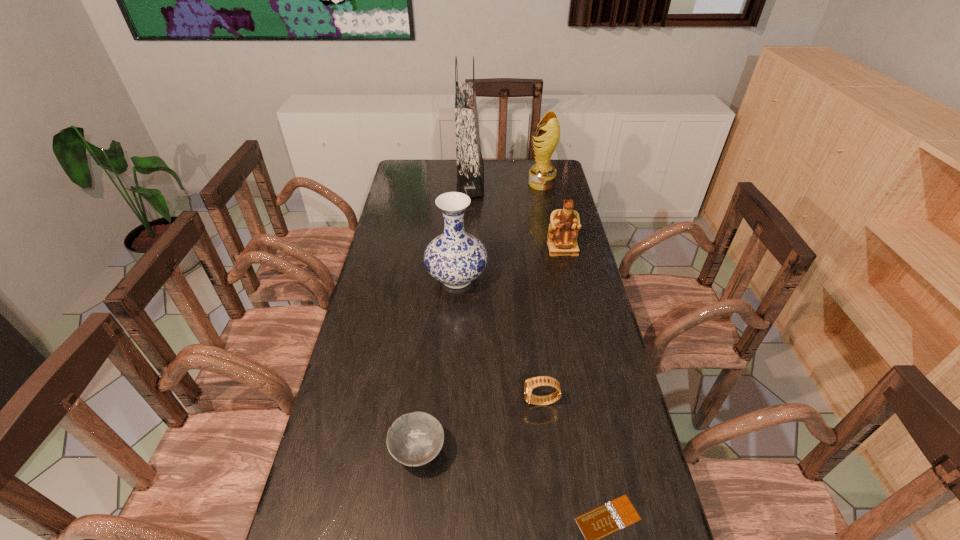
I want to click on award that is at the far edge, so click(x=542, y=175).

In order to click on award located at the right edge in this screenshot , I will do `click(542, 175)`.

The image size is (960, 540). What are the coordinates of `figurine at the right edge` in the screenshot? It's located at (564, 226).

Identify the location of object positioned at the far right corner. (542, 175).

Identify the location of vacant space at the left edge. The height and width of the screenshot is (540, 960). (414, 225).

The image size is (960, 540). In the image, there is a desktop. What are the coordinates of `vacant space at the right edge` in the screenshot? It's located at (586, 381).

At what (x,y) coordinates should I click in order to perform the action: click on vacant area at the far left corner of the desktop. Please return your answer as a coordinate pair (x, y). Looking at the image, I should click on (420, 177).

Find the location of `vacant space in between the fourth nearest object and the third nearest object`. vacant space in between the fourth nearest object and the third nearest object is located at coordinates (499, 340).

Image resolution: width=960 pixels, height=540 pixels. Identify the location of free area in between the fifth nearest object and the watch. (552, 325).

At what (x,y) coordinates should I click in order to perform the action: click on vacant space in between the figurine and the shopping bag. Please return your answer as a coordinate pair (x, y). The image size is (960, 540). Looking at the image, I should click on (516, 215).